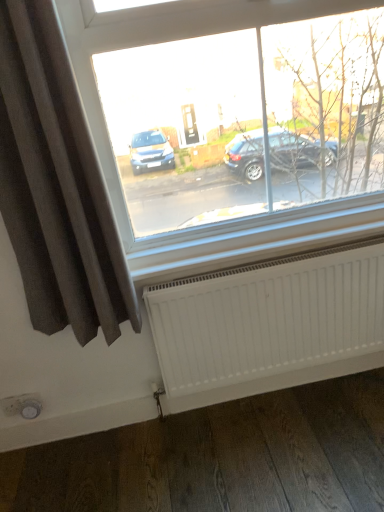
Question: Looking at the image, does dark grey fabric curtain at left seem bigger or smaller compared to white matte radiator at lower center?

Choices:
 (A) small
 (B) big

Answer: (B)

Question: Considering the relative positions of dark grey fabric curtain at left and white matte radiator at lower center in the image provided, is dark grey fabric curtain at left to the left or to the right of white matte radiator at lower center?

Choices:
 (A) right
 (B) left

Answer: (B)

Question: Would you say dark grey fabric curtain at left is inside or outside white matte radiator at lower center?

Choices:
 (A) outside
 (B) inside

Answer: (A)

Question: Would you say white matte radiator at lower center is inside or outside dark grey fabric curtain at left?

Choices:
 (A) outside
 (B) inside

Answer: (A)

Question: In terms of width, does white matte radiator at lower center look wider or thinner when compared to dark grey fabric curtain at left?

Choices:
 (A) wide
 (B) thin

Answer: (B)

Question: From a real-world perspective, is white matte radiator at lower center physically located above or below dark grey fabric curtain at left?

Choices:
 (A) below
 (B) above

Answer: (A)

Question: Based on their positions, is white matte radiator at lower center located to the left or right of dark grey fabric curtain at left?

Choices:
 (A) left
 (B) right

Answer: (B)